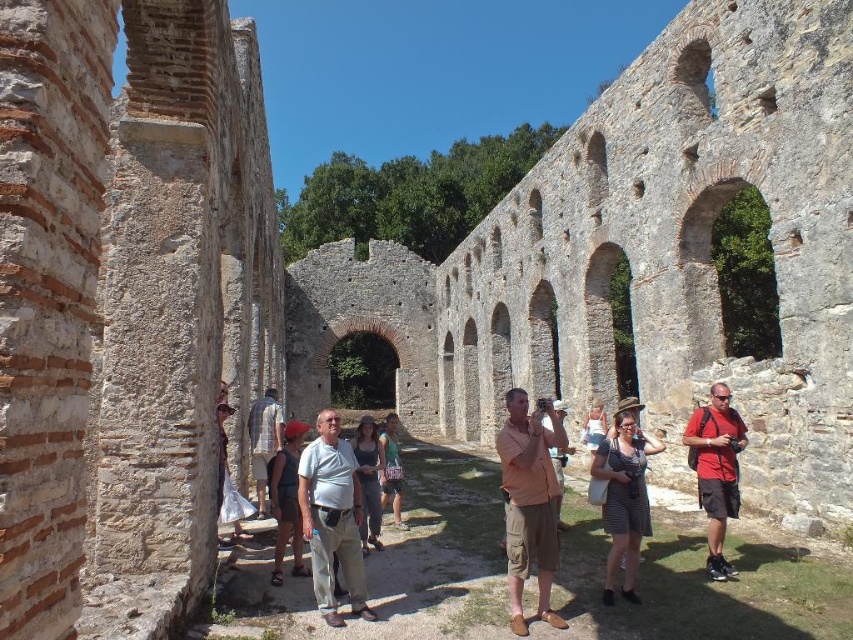
Does stone wall at left appear on the right side of white cotton shirt at center?

In fact, stone wall at left is to the left of white cotton shirt at center.

Which is in front, point (142, 150) or point (328, 540)?

Point (142, 150) is more forward.

Is point (91, 99) positioned after point (312, 573)?

No, (91, 99) is in front of (312, 573).

Locate an element on the screen. The height and width of the screenshot is (640, 853). stone wall at left is located at coordinates (123, 289).

Find the location of a particular element. tan cotton shirt at center is located at coordinates (529, 502).

Who is positioned more to the right, tan cotton shirt at center or denim shorts at center?

tan cotton shirt at center

Locate an element on the screen. tan cotton shirt at center is located at coordinates [529, 502].

Is tan cotton shirt at center taller than green fabric bag at center?

A: Indeed, tan cotton shirt at center has a greater height compared to green fabric bag at center.

Describe the element at coordinates (529, 502) in the screenshot. I see `tan cotton shirt at center` at that location.

Where is `tan cotton shirt at center`? tan cotton shirt at center is located at coordinates pos(529,502).